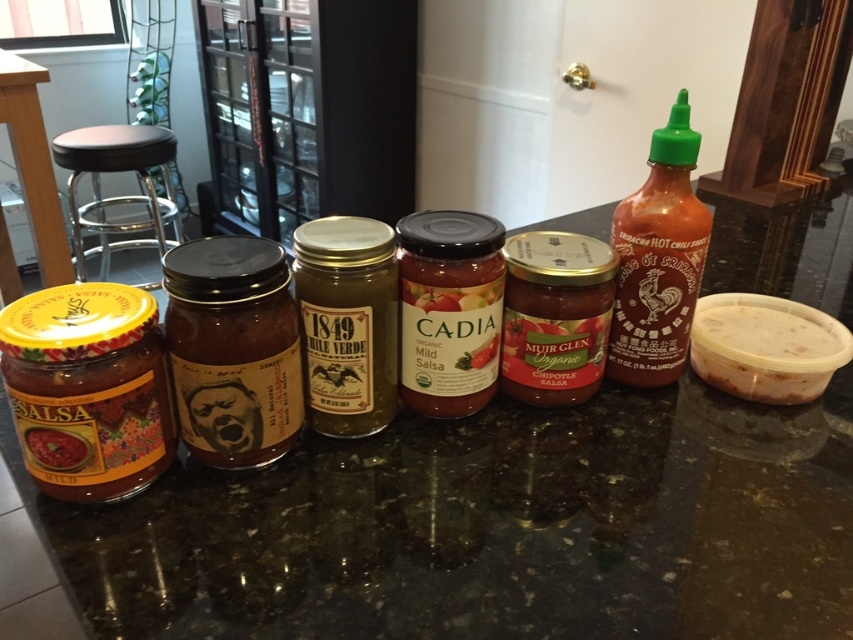
This screenshot has width=853, height=640. Describe the element at coordinates (766, 346) in the screenshot. I see `white plastic container at right` at that location.

Between point (799, 324) and point (39, 461), which one is positioned behind?

Point (799, 324)

Locate an element on the screen. white plastic container at right is located at coordinates pos(766,346).

Is green plastic bottle at right further to camera compared to white plastic container at right?

That is False.

The image size is (853, 640). What do you see at coordinates (659, 259) in the screenshot?
I see `green plastic bottle at right` at bounding box center [659, 259].

The height and width of the screenshot is (640, 853). I want to click on green plastic bottle at right, so click(659, 259).

Who is more distant from viewer, (x=704, y=304) or (x=32, y=186)?

Point (x=32, y=186)

Can you confirm if white plastic container at right is positioned to the left of yellow plastic container at left?

In fact, white plastic container at right is to the right of yellow plastic container at left.

You are a GUI agent. You are given a task and a screenshot of the screen. Output one action in this format:
    pyautogui.click(x=<x>, y=<y>)
    Task: Click on the white plastic container at right
    This screenshot has width=853, height=640.
    Given the screenshot: What is the action you would take?
    pyautogui.click(x=766, y=346)